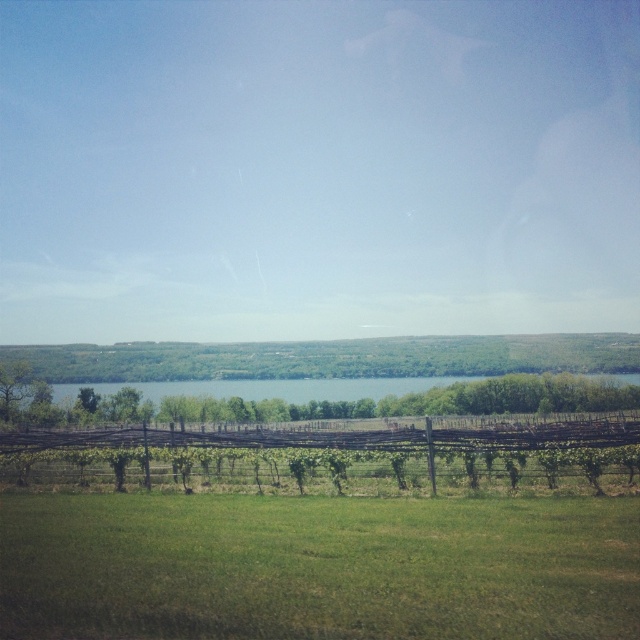
You are standing at the edge of the brown wooden fence at center and want to walk towards the green grassy field at lower center. Which direction should you face to head directly towards it?

You should face to the right to head directly towards the green grassy field at lower center since it is located to the right of the brown wooden fence at center.